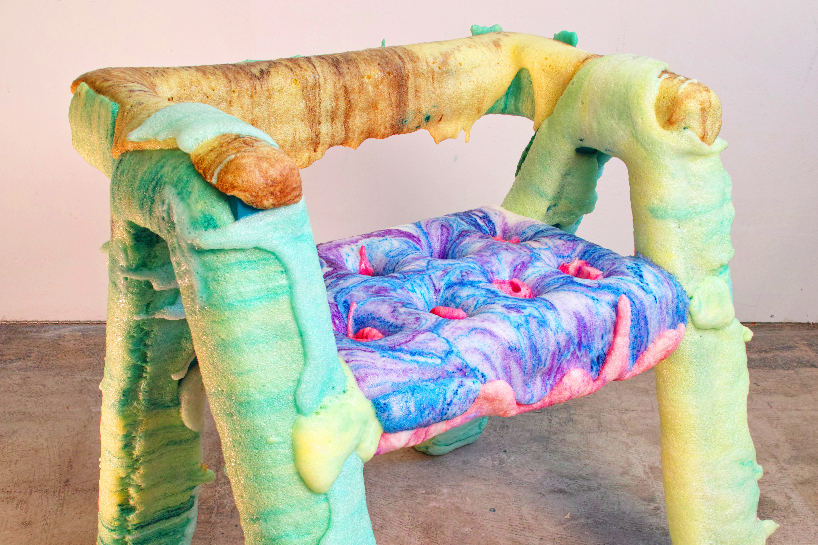
You are a GUI agent. You are given a task and a screenshot of the screen. Output one action in this format:
    pyautogui.click(x=<x>, y=<y>)
    Task: Click on the beige wall
    The height and width of the screenshot is (545, 818).
    Given the screenshot: What is the action you would take?
    pyautogui.click(x=789, y=92)